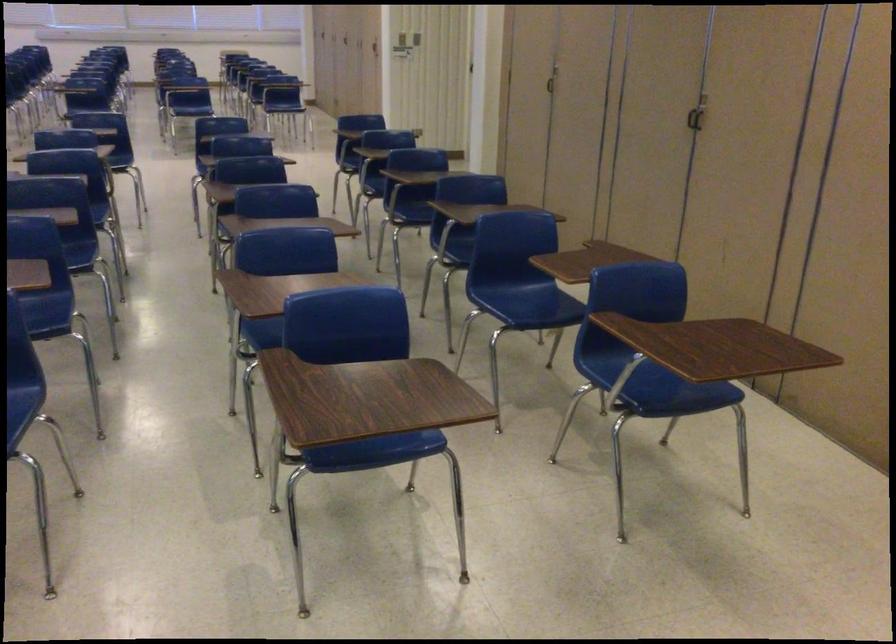
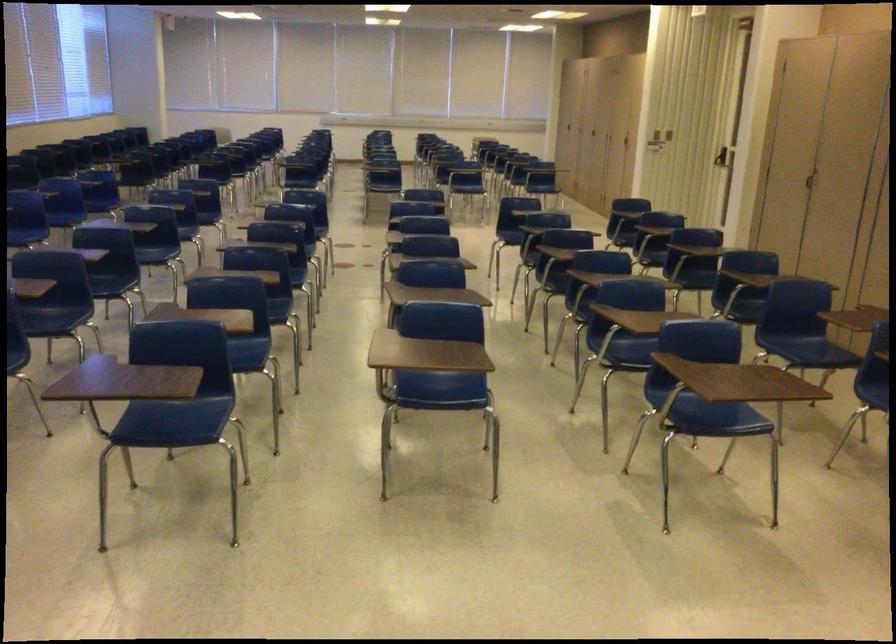
Find the pixel in the second image that matches (x=595, y=79) in the first image.

(853, 173)